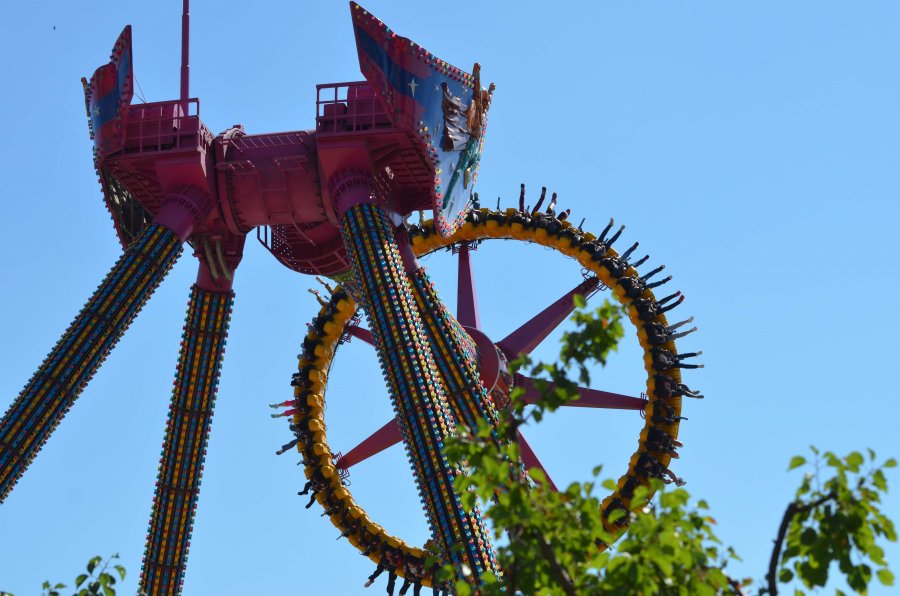
The image size is (900, 596). In order to click on right front leg in this screenshot , I will do `click(419, 412)`.